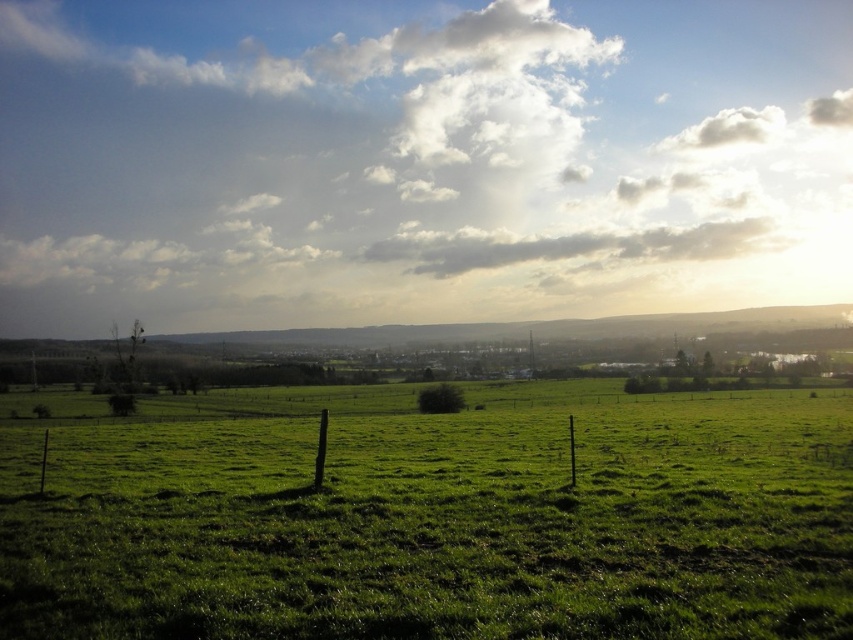
Can you confirm if white fluffy cloud at upper center is positioned below green grassy field at center?

Incorrect, white fluffy cloud at upper center is not positioned below green grassy field at center.

Is point (595, 56) farther from camera compared to point (293, 588)?

Yes, point (595, 56) is farther from viewer.

At what (x,y) coordinates should I click in order to perform the action: click on white fluffy cloud at upper center. Please return your answer as a coordinate pair (x, y). The image size is (853, 640). Looking at the image, I should click on (418, 161).